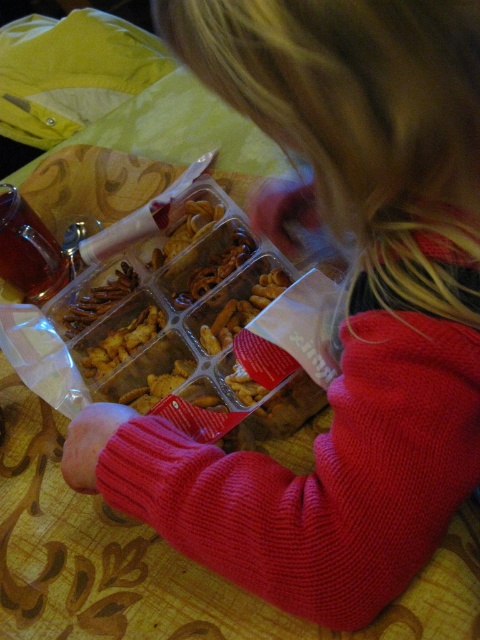
Question: Is matte plastic pretzels at center below brown matte snack at center?

Choices:
 (A) yes
 (B) no

Answer: (B)

Question: Which object is the closest to the brown matte pretzel at center?

Choices:
 (A) brown matte snack at center
 (B) matte plastic snack tray at center

Answer: (A)

Question: Which object is positioned farthest from the matte plastic snack tray at center?

Choices:
 (A) matte plastic pretzels at center
 (B) brown matte pretzel at center
 (C) brown matte snack at center

Answer: (B)

Question: Can you confirm if matte plastic pretzels at center is smaller than brown matte pretzel at center?

Choices:
 (A) no
 (B) yes

Answer: (A)

Question: Which object is closer to the camera taking this photo?

Choices:
 (A) brown matte snack at center
 (B) matte plastic pretzels at center

Answer: (B)

Question: Considering the relative positions of matte plastic snack tray at center and matte plastic pretzels at center in the image provided, where is matte plastic snack tray at center located with respect to matte plastic pretzels at center?

Choices:
 (A) below
 (B) above

Answer: (A)